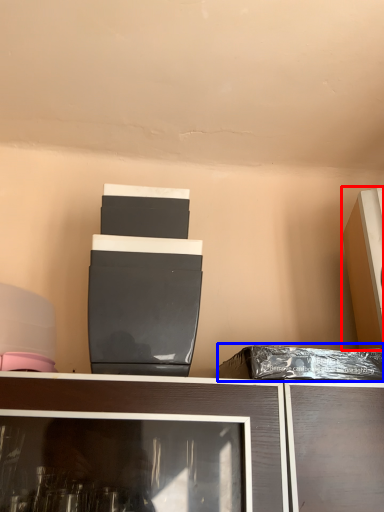
Question: Which point is closer to the camera, appliance (highlighted by a red box) or garbage (highlighted by a blue box)?

Choices:
 (A) appliance
 (B) garbage

Answer: (B)